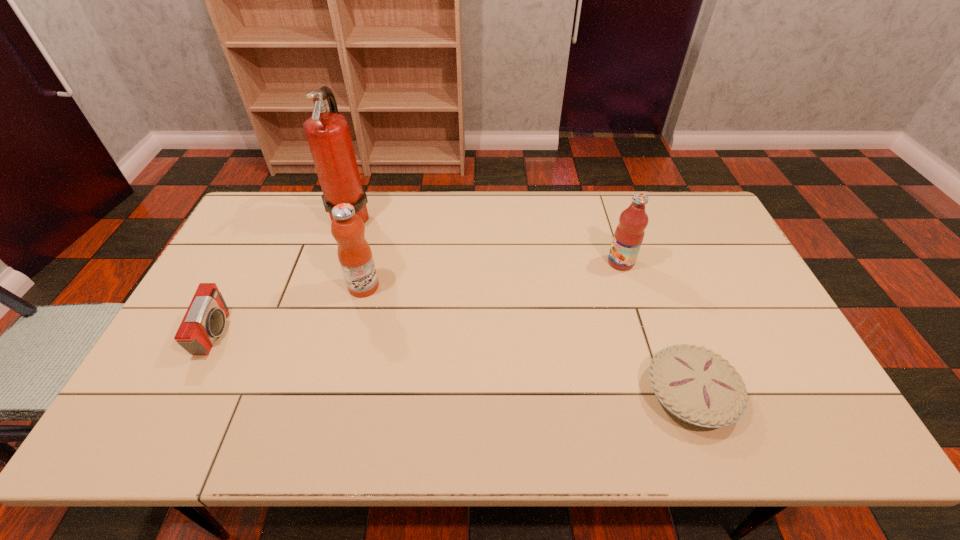
I want to click on vacant space at the near edge, so click(x=203, y=417).

In the image, there is a desktop. Where is `free region at the left edge`? free region at the left edge is located at coordinates (x=230, y=270).

Identify the location of vacant space at the right edge of the desktop. (724, 287).

Find the location of `blank space at the far right corner of the desktop`. blank space at the far right corner of the desktop is located at coordinates (688, 201).

Find the location of a particular element. The width and height of the screenshot is (960, 540). free space at the near right corner is located at coordinates (844, 438).

Where is `free space between the leftmost object and the tallest object`? Image resolution: width=960 pixels, height=540 pixels. free space between the leftmost object and the tallest object is located at coordinates (283, 275).

The height and width of the screenshot is (540, 960). In order to click on free point between the third nearest object and the fourth tallest object in this screenshot , I will do `click(290, 310)`.

At what (x,y) coordinates should I click in order to perform the action: click on empty space between the leftmost object and the third farthest object. Please return your answer as a coordinate pair (x, y). Looking at the image, I should click on (290, 310).

I want to click on vacant area that lies between the camera and the shortest object, so click(453, 363).

The image size is (960, 540). I want to click on free space between the nearer fruit juice and the fourth nearest object, so click(x=492, y=274).